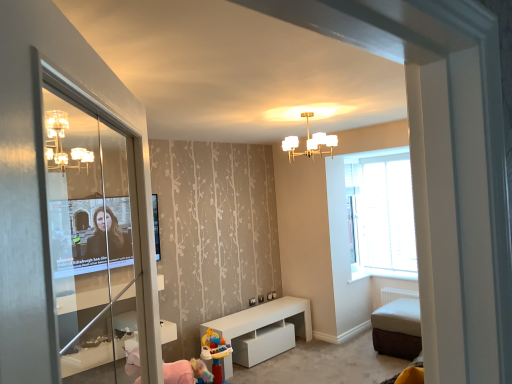
Question: Is clear glass screen door at left to the left of white glass chandelier at upper center from the viewer's perspective?

Choices:
 (A) yes
 (B) no

Answer: (A)

Question: Is clear glass screen door at left positioned far away from white glass chandelier at upper center?

Choices:
 (A) no
 (B) yes

Answer: (B)

Question: Is clear glass screen door at left facing away from white glass chandelier at upper center?

Choices:
 (A) yes
 (B) no

Answer: (B)

Question: From the image's perspective, is clear glass screen door at left over white glass chandelier at upper center?

Choices:
 (A) no
 (B) yes

Answer: (A)

Question: Is clear glass screen door at left outside white glass chandelier at upper center?

Choices:
 (A) no
 (B) yes

Answer: (B)

Question: Looking at their shapes, would you say white fabric ottoman at lower right is wider or thinner than transparent glass window at right?

Choices:
 (A) wide
 (B) thin

Answer: (A)

Question: From their relative heights in the image, would you say white fabric ottoman at lower right is taller or shorter than transparent glass window at right?

Choices:
 (A) short
 (B) tall

Answer: (A)

Question: Considering their positions, is white fabric ottoman at lower right located in front of or behind transparent glass window at right?

Choices:
 (A) front
 (B) behind

Answer: (A)

Question: Based on their sizes in the image, would you say white fabric ottoman at lower right is bigger or smaller than transparent glass window at right?

Choices:
 (A) big
 (B) small

Answer: (A)

Question: Is white glass chandelier at upper center to the left or to the right of white fabric ottoman at lower right in the image?

Choices:
 (A) left
 (B) right

Answer: (A)

Question: Does point (288, 145) appear closer or farther from the camera than point (382, 342)?

Choices:
 (A) farther
 (B) closer

Answer: (A)

Question: Considering the positions of white glass chandelier at upper center and white fabric ottoman at lower right in the image, is white glass chandelier at upper center taller or shorter than white fabric ottoman at lower right?

Choices:
 (A) tall
 (B) short

Answer: (B)

Question: From a real-world perspective, is white glass chandelier at upper center above or below white fabric ottoman at lower right?

Choices:
 (A) below
 (B) above

Answer: (B)

Question: Considering their positions, is white fabric ottoman at lower right located in front of or behind clear glass screen door at left?

Choices:
 (A) front
 (B) behind

Answer: (B)

Question: From a real-world perspective, is white fabric ottoman at lower right positioned above or below clear glass screen door at left?

Choices:
 (A) above
 (B) below

Answer: (B)